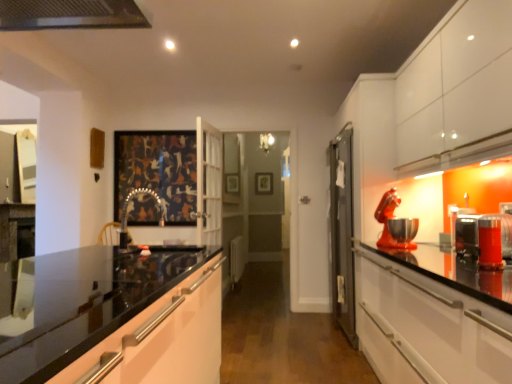
Question: In terms of width, does metallic silver toaster at right, the third appliance positioned from the back, look wider or thinner when compared to metallic faucet at center?

Choices:
 (A) wide
 (B) thin

Answer: (B)

Question: Based on their sizes in the image, would you say metallic silver toaster at right, the second appliance from the front, is bigger or smaller than metallic faucet at center?

Choices:
 (A) big
 (B) small

Answer: (B)

Question: Which object is the closest to the metallic silver toaster at right, the 3th appliance in the front-to-back sequence?

Choices:
 (A) translucent orange glass at right, which is counted as the 1th appliance, starting from the front
 (B) glossy black countertop at center
 (C) wooden picture frame at center, the 2th picture frame positioned from the left
 (D) metallic silver toaster at right, the second appliance from the front
 (E) dark fabric picture frame at center, acting as the 1th picture frame starting from the front

Answer: (A)

Question: Which is nearer to the dark fabric picture frame at center, the 2th picture frame from the back?

Choices:
 (A) metallic red stand mixer at right, which is the fourth appliance in front-to-back order
 (B) metallic faucet at center
 (C) metallic silver toaster at right, the second appliance from the front
 (D) glossy black countertop at center
 (E) translucent orange glass at right, which is counted as the 1th appliance, starting from the front

Answer: (B)